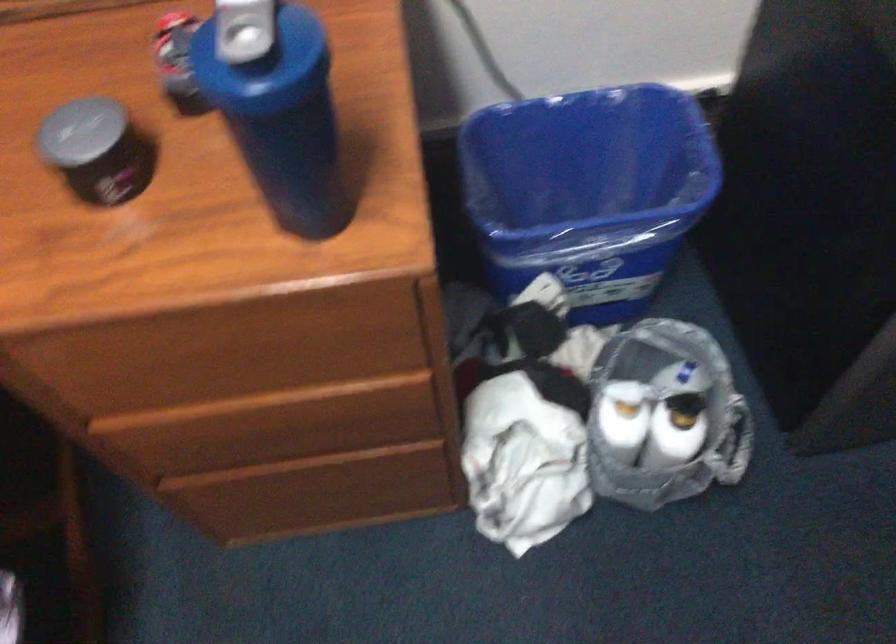
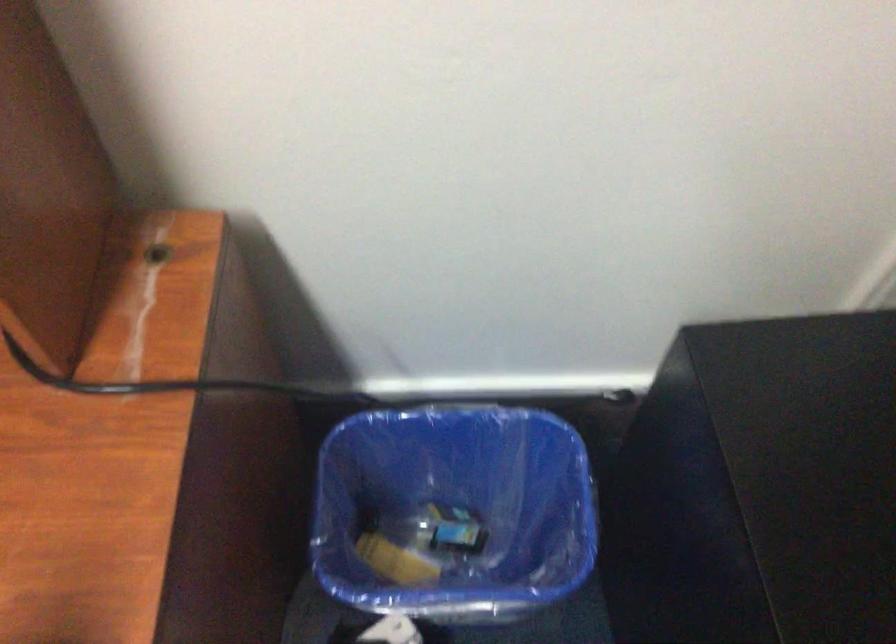
Question: The images are taken continuously from a first-person perspective. In which direction is your viewpoint rotating?

Choices:
 (A) Left
 (B) Right
 (C) Up
 (D) Down

Answer: (C)